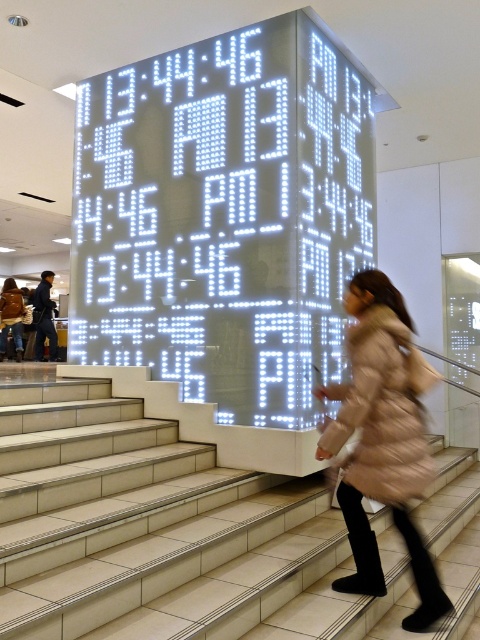
Does white tile stairs at center appear under dark blue jeans at left?

Indeed, white tile stairs at center is positioned under dark blue jeans at left.

What do you see at coordinates (159, 531) in the screenshot? I see `white tile stairs at center` at bounding box center [159, 531].

Locate an element on the screen. white tile stairs at center is located at coordinates (159, 531).

Does white tile stairs at center appear over light brown fur coat at lower left?

No, white tile stairs at center is not above light brown fur coat at lower left.

Does white tile stairs at center have a lesser width compared to light brown fur coat at lower left?

No, white tile stairs at center is not thinner than light brown fur coat at lower left.

Locate an element on the screen. This screenshot has width=480, height=640. white tile stairs at center is located at coordinates (159, 531).

Identify the location of white tile stairs at center. The image size is (480, 640). (159, 531).

In the scene shown: Who is more distant from viewer, (44, 336) or (0, 349)?

Point (0, 349)

Is point (45, 292) less distant than point (15, 356)?

Yes, it is in front of point (15, 356).

The width and height of the screenshot is (480, 640). What do you see at coordinates (44, 317) in the screenshot?
I see `dark blue jeans at left` at bounding box center [44, 317].

I want to click on dark blue jeans at left, so click(x=44, y=317).